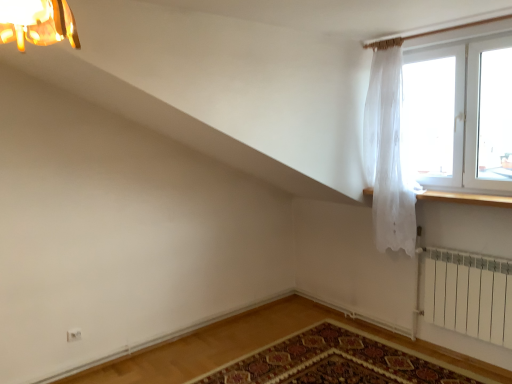
Question: From a real-world perspective, is carpeted mat at lower center positioned above or below transparent glass window at upper right?

Choices:
 (A) above
 (B) below

Answer: (B)

Question: Visually, is carpeted mat at lower center positioned to the left or to the right of transparent glass window at upper right?

Choices:
 (A) left
 (B) right

Answer: (A)

Question: Which object is the farthest from the white sheer curtain at upper right?

Choices:
 (A) wooden at right
 (B) carpeted mat at lower center
 (C) transparent glass window at upper right

Answer: (B)

Question: Based on their relative distances, which object is farther from the white sheer curtain at upper right?

Choices:
 (A) wooden at right
 (B) transparent glass window at upper right
 (C) carpeted mat at lower center

Answer: (C)